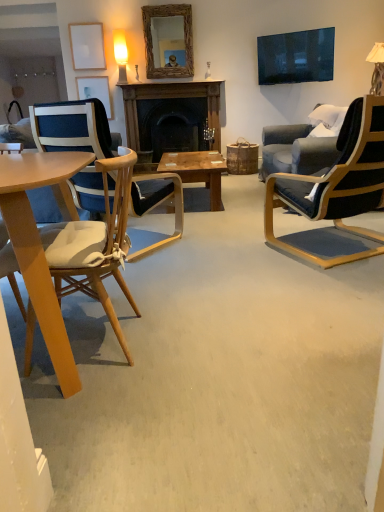
In order to click on vacant space underneath light brown wood chair at left, which is counted as the 2th chair, starting from the right (from a real-world perspective) in this screenshot , I will do `click(98, 336)`.